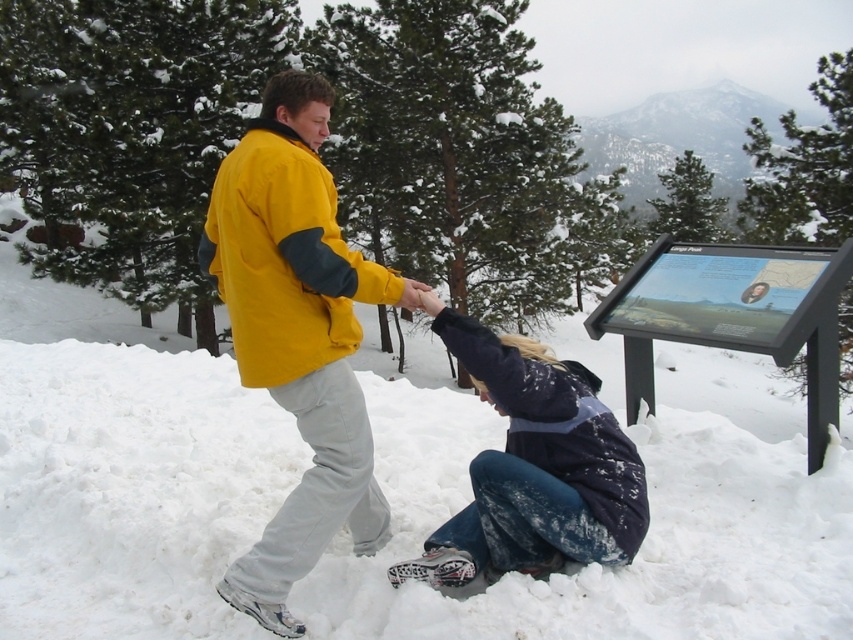
Question: Which of the following is the closest to the observer?

Choices:
 (A) dark blue denim jeans at lower center
 (B) yellow fleece jacket at upper center

Answer: (B)

Question: Which object is farther from the camera taking this photo?

Choices:
 (A) yellow fleece jacket at upper center
 (B) white fluffy snow at lower center
 (C) yellow fleece jacket at center
 (D) dark blue denim jeans at lower center

Answer: (D)

Question: In this image, where is yellow fleece jacket at center located relative to dark blue denim jeans at lower center?

Choices:
 (A) right
 (B) left

Answer: (B)

Question: From the image, what is the correct spatial relationship of dark blue denim jeans at lower center in relation to yellow fleece jacket at upper center?

Choices:
 (A) below
 (B) above

Answer: (A)

Question: Does yellow fleece jacket at center appear under dark blue denim jeans at lower center?

Choices:
 (A) no
 (B) yes

Answer: (A)

Question: Which of these objects is positioned closest to the yellow fleece jacket at center?

Choices:
 (A) white fluffy snow at lower center
 (B) dark blue denim jeans at lower center

Answer: (B)